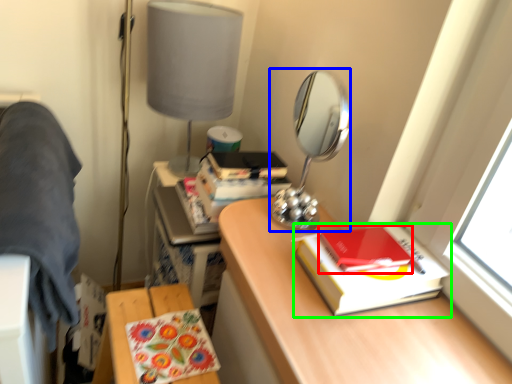
Question: Which is nearer to the notebook (highlighted by a red box)? mirror (highlighted by a blue box) or paperback book (highlighted by a green box).

Choices:
 (A) mirror
 (B) paperback book

Answer: (B)